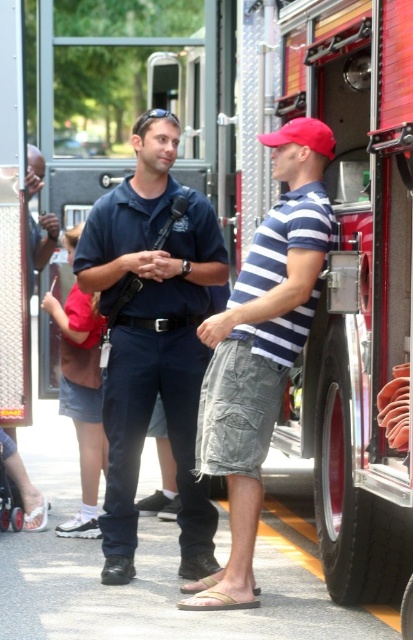
Question: Can you confirm if striped cotton shirt at center is bigger than red matte baseball cap at center?

Choices:
 (A) yes
 (B) no

Answer: (A)

Question: Is dark blue uniform at center below red matte baseball cap at center?

Choices:
 (A) no
 (B) yes

Answer: (B)

Question: Which point is farther to the camera?

Choices:
 (A) red matte baseball cap at center
 (B) dark blue uniform at center
 (C) striped cotton shirt at center

Answer: (B)

Question: Which point appears closest to the camera in this image?

Choices:
 (A) (315, 140)
 (B) (203, 496)

Answer: (A)

Question: Which point is farther to the camera?

Choices:
 (A) (161, 260)
 (B) (308, 131)
 (C) (244, 339)

Answer: (A)

Question: Does striped cotton shirt at center have a larger size compared to red matte baseball cap at center?

Choices:
 (A) no
 (B) yes

Answer: (B)